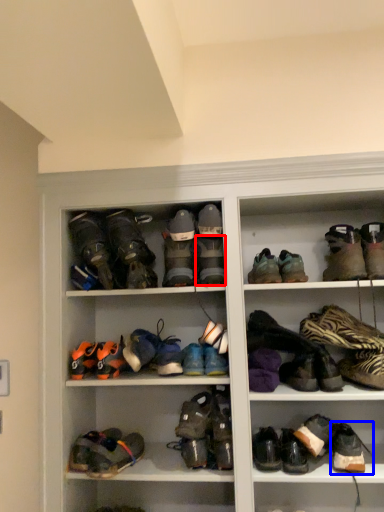
Question: Which point is further to the camera, footwear (highlighted by a red box) or footwear (highlighted by a blue box)?

Choices:
 (A) footwear
 (B) footwear

Answer: (A)